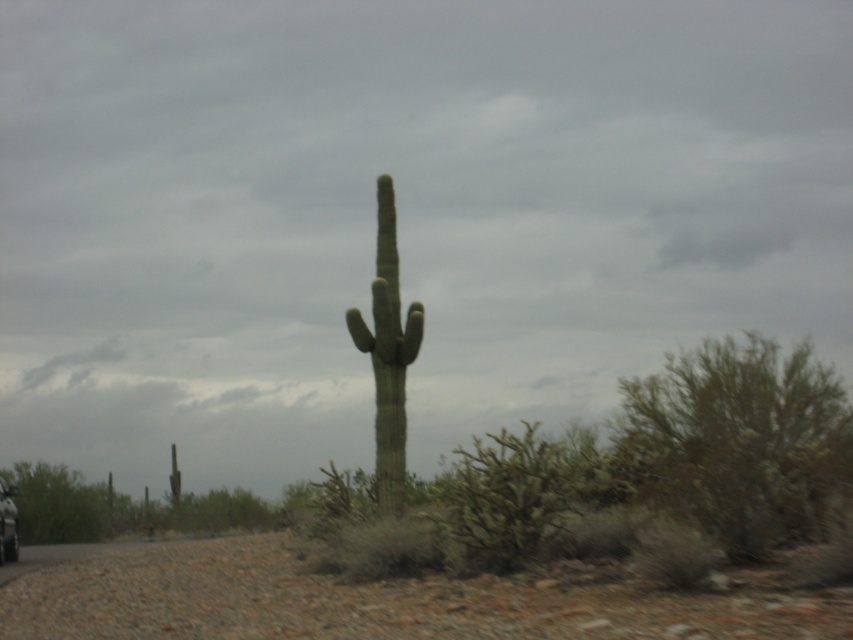
Question: Does green fuzzy cactus at center appear under metallic silver car at lower left?

Choices:
 (A) yes
 (B) no

Answer: (B)

Question: Can you confirm if green fuzzy cactus at center is bigger than metallic silver car at lower left?

Choices:
 (A) no
 (B) yes

Answer: (B)

Question: Can you confirm if green fuzzy cactus at center is smaller than metallic silver car at lower left?

Choices:
 (A) no
 (B) yes

Answer: (A)

Question: Among these objects, which one is farthest from the camera?

Choices:
 (A) metallic silver car at lower left
 (B) green fuzzy cactus at center

Answer: (A)

Question: Which object is positioned farthest from the green spiny cactus at center?

Choices:
 (A) green fuzzy cactus at center
 (B) metallic silver car at lower left

Answer: (B)

Question: Which is farther from the green spiny cactus at center?

Choices:
 (A) metallic silver car at lower left
 (B) green fuzzy cactus at center

Answer: (A)